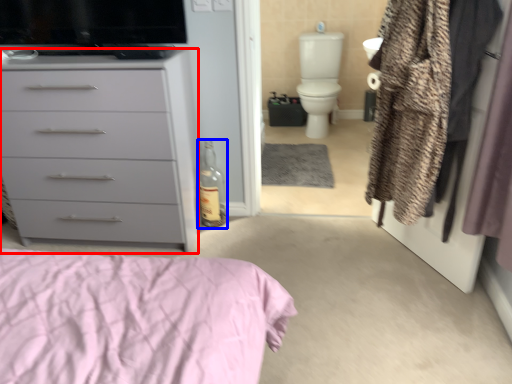
Question: Which of the following is the farthest to the observer, chest of drawers (highlighted by a red box) or bottle (highlighted by a blue box)?

Choices:
 (A) chest of drawers
 (B) bottle

Answer: (B)